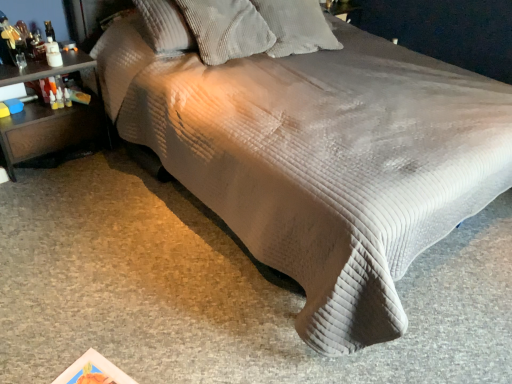
What do you see at coordinates (226, 29) in the screenshot? The image size is (512, 384). I see `corduroy pillow at upper center, positioned as the first pillow in left-to-right order` at bounding box center [226, 29].

The width and height of the screenshot is (512, 384). What do you see at coordinates (297, 27) in the screenshot?
I see `white corduroy pillow at upper center, which is counted as the 1th pillow, starting from the right` at bounding box center [297, 27].

The height and width of the screenshot is (384, 512). Identify the location of corduroy pillow at upper center, positioned as the first pillow in left-to-right order. (226, 29).

Is brown wood nightstand at left not inside white corduroy pillow at upper center, which is counted as the 1th pillow, starting from the right?

That's correct, brown wood nightstand at left is outside of white corduroy pillow at upper center, which is counted as the 1th pillow, starting from the right.

Who is more distant, brown wood nightstand at left or white corduroy pillow at upper center, which is counted as the 1th pillow, starting from the right?

→ Positioned behind is white corduroy pillow at upper center, which is counted as the 1th pillow, starting from the right.

Is brown wood nightstand at left bigger or smaller than white corduroy pillow at upper center, which is counted as the 1th pillow, starting from the right?

Clearly, brown wood nightstand at left is larger in size than white corduroy pillow at upper center, which is counted as the 1th pillow, starting from the right.

Could you measure the distance between brown wood nightstand at left and white corduroy pillow at upper center, marked as the second pillow in a left-to-right arrangement?

The distance of brown wood nightstand at left from white corduroy pillow at upper center, marked as the second pillow in a left-to-right arrangement, is 3.94 feet.

From the image's perspective, would you say white corduroy pillow at upper center, marked as the second pillow in a left-to-right arrangement, is positioned over corduroy pillow at upper center, the second pillow from the right?

Correct, white corduroy pillow at upper center, marked as the second pillow in a left-to-right arrangement, appears higher than corduroy pillow at upper center, the second pillow from the right, in the image.

Is white corduroy pillow at upper center, which is counted as the 1th pillow, starting from the right, taller or shorter than corduroy pillow at upper center, the second pillow from the right?

In the image, white corduroy pillow at upper center, which is counted as the 1th pillow, starting from the right, appears to be shorter than corduroy pillow at upper center, the second pillow from the right.

Measure the distance between white corduroy pillow at upper center, marked as the second pillow in a left-to-right arrangement, and corduroy pillow at upper center, the second pillow from the right.

The distance of white corduroy pillow at upper center, marked as the second pillow in a left-to-right arrangement, from corduroy pillow at upper center, the second pillow from the right, is 7.97 inches.

Does point (317, 19) appear closer or farther from the camera than point (212, 50)?

Clearly, point (317, 19) is more distant from the camera than point (212, 50).

Does corduroy pillow at upper center, positioned as the first pillow in left-to-right order, turn towards brown wood nightstand at left?

No, corduroy pillow at upper center, positioned as the first pillow in left-to-right order, does not turn towards brown wood nightstand at left.

Does corduroy pillow at upper center, the second pillow from the right, appear on the left side of brown wood nightstand at left?

In fact, corduroy pillow at upper center, the second pillow from the right, is to the right of brown wood nightstand at left.

In terms of size, does corduroy pillow at upper center, positioned as the first pillow in left-to-right order, appear bigger or smaller than brown wood nightstand at left?

Considering their sizes, corduroy pillow at upper center, positioned as the first pillow in left-to-right order, takes up less space than brown wood nightstand at left.

Between point (41, 63) and point (213, 21), which one is positioned behind?

The point (213, 21) is farther.

Is the depth of brown wood nightstand at left less than that of corduroy pillow at upper center, positioned as the first pillow in left-to-right order?

Yes, the depth of brown wood nightstand at left is less than that of corduroy pillow at upper center, positioned as the first pillow in left-to-right order.

From a real-world perspective, which object rests below the other?

In real-world perspective, brown wood nightstand at left is lower.

From the image's perspective, between brown wood nightstand at left and corduroy pillow at upper center, the second pillow from the right, which one is located above?

corduroy pillow at upper center, the second pillow from the right, from the image's perspective.

Looking at their sizes, would you say corduroy pillow at upper center, the second pillow from the right, is wider or thinner than white corduroy pillow at upper center, marked as the second pillow in a left-to-right arrangement?

Clearly, corduroy pillow at upper center, the second pillow from the right, has less width compared to white corduroy pillow at upper center, marked as the second pillow in a left-to-right arrangement.

Based on the photo, looking at the image, does corduroy pillow at upper center, positioned as the first pillow in left-to-right order, seem bigger or smaller compared to white corduroy pillow at upper center, marked as the second pillow in a left-to-right arrangement?

Clearly, corduroy pillow at upper center, positioned as the first pillow in left-to-right order, is larger in size than white corduroy pillow at upper center, marked as the second pillow in a left-to-right arrangement.

Do you think corduroy pillow at upper center, positioned as the first pillow in left-to-right order, is within white corduroy pillow at upper center, which is counted as the 1th pillow, starting from the right, or outside of it?

corduroy pillow at upper center, positioned as the first pillow in left-to-right order, is located beyond the bounds of white corduroy pillow at upper center, which is counted as the 1th pillow, starting from the right.

Would you say corduroy pillow at upper center, positioned as the first pillow in left-to-right order, is to the left or to the right of white corduroy pillow at upper center, marked as the second pillow in a left-to-right arrangement, in the picture?

Based on their positions, corduroy pillow at upper center, positioned as the first pillow in left-to-right order, is located to the left of white corduroy pillow at upper center, marked as the second pillow in a left-to-right arrangement.

In the scene shown: How distant is white corduroy pillow at upper center, which is counted as the 1th pillow, starting from the right, from brown wood nightstand at left?

white corduroy pillow at upper center, which is counted as the 1th pillow, starting from the right, is 1.20 meters from brown wood nightstand at left.

From a real-world perspective, which is physically below, white corduroy pillow at upper center, which is counted as the 1th pillow, starting from the right, or brown wood nightstand at left?

In real-world perspective, brown wood nightstand at left is lower.

Does white corduroy pillow at upper center, which is counted as the 1th pillow, starting from the right, have a greater width compared to brown wood nightstand at left?

Correct, the width of white corduroy pillow at upper center, which is counted as the 1th pillow, starting from the right, exceeds that of brown wood nightstand at left.

Considering the sizes of objects white corduroy pillow at upper center, marked as the second pillow in a left-to-right arrangement, and brown wood nightstand at left in the image provided, who is bigger, white corduroy pillow at upper center, marked as the second pillow in a left-to-right arrangement, or brown wood nightstand at left?

With larger size is brown wood nightstand at left.

From a real-world perspective, count 1st pillows upward from the brown wood nightstand at left and point to it. Please provide its 2D coordinates.

[(297, 27)]

The image size is (512, 384). I want to click on pillow lying below the white corduroy pillow at upper center, marked as the second pillow in a left-to-right arrangement (from the image's perspective), so click(x=226, y=29).

Estimate the real-world distances between objects in this image. Which object is closer to white corduroy pillow at upper center, marked as the second pillow in a left-to-right arrangement, brown wood nightstand at left or corduroy pillow at upper center, the second pillow from the right?

corduroy pillow at upper center, the second pillow from the right, is closer to white corduroy pillow at upper center, marked as the second pillow in a left-to-right arrangement.

Which object lies nearer to the anchor point brown wood nightstand at left, white corduroy pillow at upper center, which is counted as the 1th pillow, starting from the right, or corduroy pillow at upper center, positioned as the first pillow in left-to-right order?

Among the two, corduroy pillow at upper center, positioned as the first pillow in left-to-right order, is located nearer to brown wood nightstand at left.

Estimate the real-world distances between objects in this image. Which object is further from brown wood nightstand at left, corduroy pillow at upper center, positioned as the first pillow in left-to-right order, or white corduroy pillow at upper center, which is counted as the 1th pillow, starting from the right?

white corduroy pillow at upper center, which is counted as the 1th pillow, starting from the right, is further to brown wood nightstand at left.

Considering their positions, is brown wood nightstand at left positioned closer to corduroy pillow at upper center, positioned as the first pillow in left-to-right order, than white corduroy pillow at upper center, marked as the second pillow in a left-to-right arrangement?

white corduroy pillow at upper center, marked as the second pillow in a left-to-right arrangement, is closer to corduroy pillow at upper center, positioned as the first pillow in left-to-right order.

Based on their spatial positions, is white corduroy pillow at upper center, which is counted as the 1th pillow, starting from the right, or brown wood nightstand at left closer to corduroy pillow at upper center, positioned as the first pillow in left-to-right order?

Among the two, white corduroy pillow at upper center, which is counted as the 1th pillow, starting from the right, is located nearer to corduroy pillow at upper center, positioned as the first pillow in left-to-right order.

Which object lies nearer to the anchor point white corduroy pillow at upper center, which is counted as the 1th pillow, starting from the right, corduroy pillow at upper center, positioned as the first pillow in left-to-right order, or brown wood nightstand at left?

corduroy pillow at upper center, positioned as the first pillow in left-to-right order, is closer to white corduroy pillow at upper center, which is counted as the 1th pillow, starting from the right.

This screenshot has height=384, width=512. What are the coordinates of `pillow between brown wood nightstand at left and white corduroy pillow at upper center, which is counted as the 1th pillow, starting from the right, in the horizontal direction` in the screenshot? It's located at (226, 29).